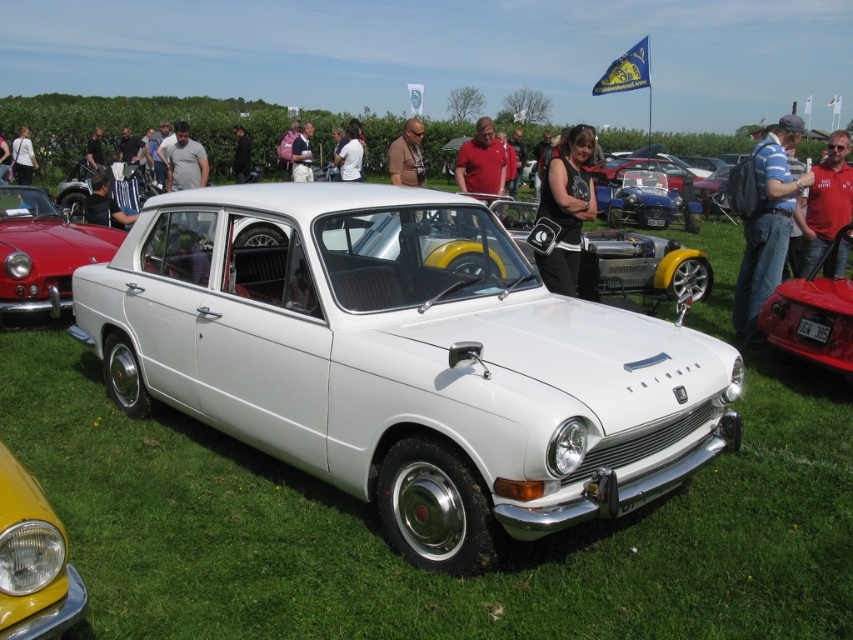
You are a photographer at the car show and need to position yourself so that both the blue denim jeans at right and the matte black jacket at center are visible in your shot. Based on their positions, where should you stand relative to these items?

You should stand above both the blue denim jeans at right and the matte black jacket at center since the blue denim jeans at right is located below the matte black jacket at center.

You are standing at the center of the grassy field where the white vintage car is parked. You want to find the shiny red car at right. Which direction should you look to see it?

The shiny red car at right is located at the right side of the image, so you should look to your right to see it.